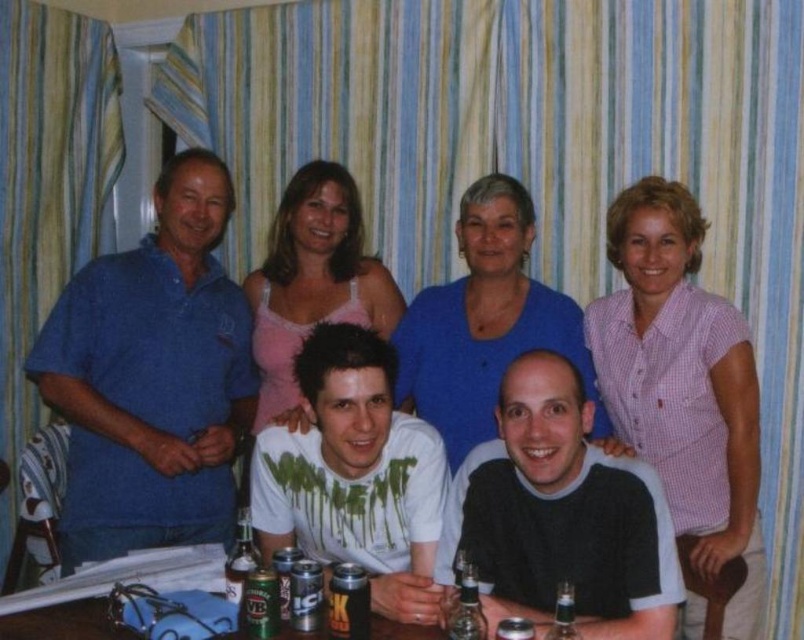
Question: Does white cotton shirt at center appear over green matte beer can at center?

Choices:
 (A) no
 (B) yes

Answer: (B)

Question: Which of these objects is positioned farthest from the blue cotton polo shirt at left?

Choices:
 (A) dark gray sweater at center
 (B) pink satin tank top at center

Answer: (A)

Question: Is pink checkered shirt at upper right smaller than green matte beer can at center?

Choices:
 (A) no
 (B) yes

Answer: (A)

Question: Can you confirm if white matte shirt at center is bigger than black matte can at center?

Choices:
 (A) yes
 (B) no

Answer: (A)

Question: Which of the following is the closest to the observer?

Choices:
 (A) blue cotton polo shirt at left
 (B) dark gray sweater at center

Answer: (B)

Question: Which object is closer to the camera taking this photo?

Choices:
 (A) dark gray sweater at center
 (B) pink checkered shirt at upper right
 (C) white cotton shirt at center
 (D) white matte shirt at center

Answer: (A)